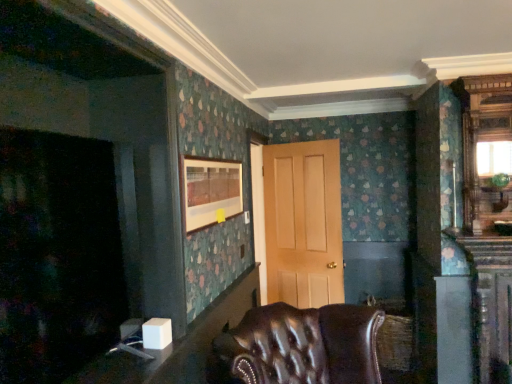
Question: Considering the relative sizes of white glossy table at lower left, placed as the 1th table when sorted from top to bottom, and white plastic table at lower left, the first table from the bottom, in the image provided, is white glossy table at lower left, placed as the 1th table when sorted from top to bottom, taller than white plastic table at lower left, the first table from the bottom,?

Choices:
 (A) no
 (B) yes

Answer: (A)

Question: Is the depth of white glossy table at lower left, the 2th table in the bottom-to-top sequence, greater than that of white plastic table at lower left, the first table from the bottom?

Choices:
 (A) yes
 (B) no

Answer: (B)

Question: Considering the relative sizes of white glossy table at lower left, the 2th table in the bottom-to-top sequence, and white plastic table at lower left, marked as the 2th table in a top-to-bottom arrangement, in the image provided, is white glossy table at lower left, the 2th table in the bottom-to-top sequence, wider than white plastic table at lower left, marked as the 2th table in a top-to-bottom arrangement,?

Choices:
 (A) yes
 (B) no

Answer: (A)

Question: Is white glossy table at lower left, placed as the 1th table when sorted from top to bottom, surrounding white plastic table at lower left, the first table from the bottom?

Choices:
 (A) yes
 (B) no

Answer: (B)

Question: Is white glossy table at lower left, placed as the 1th table when sorted from top to bottom, positioned beyond the bounds of white plastic table at lower left, marked as the 2th table in a top-to-bottom arrangement?

Choices:
 (A) yes
 (B) no

Answer: (A)

Question: Does white glossy table at lower left, the 2th table in the bottom-to-top sequence, appear on the left side of white plastic table at lower left, the first table from the bottom?

Choices:
 (A) no
 (B) yes

Answer: (B)

Question: Considering the relative sizes of leather tufted chair at lower center and white plastic table at lower left, marked as the 2th table in a top-to-bottom arrangement, in the image provided, is leather tufted chair at lower center taller than white plastic table at lower left, marked as the 2th table in a top-to-bottom arrangement,?

Choices:
 (A) no
 (B) yes

Answer: (A)

Question: Can you confirm if leather tufted chair at lower center is bigger than white plastic table at lower left, the first table from the bottom?

Choices:
 (A) no
 (B) yes

Answer: (B)

Question: From the image's perspective, is leather tufted chair at lower center beneath white plastic table at lower left, marked as the 2th table in a top-to-bottom arrangement?

Choices:
 (A) yes
 (B) no

Answer: (A)

Question: Does leather tufted chair at lower center lie behind white plastic table at lower left, marked as the 2th table in a top-to-bottom arrangement?

Choices:
 (A) no
 (B) yes

Answer: (A)

Question: Could you tell me if leather tufted chair at lower center is facing white plastic table at lower left, marked as the 2th table in a top-to-bottom arrangement?

Choices:
 (A) no
 (B) yes

Answer: (A)

Question: Is leather tufted chair at lower center located outside white plastic table at lower left, the first table from the bottom?

Choices:
 (A) yes
 (B) no

Answer: (A)

Question: From a real-world perspective, is matte wooden picture frame at upper center positioned over white glossy table at lower left, placed as the 1th table when sorted from top to bottom, based on gravity?

Choices:
 (A) yes
 (B) no

Answer: (A)